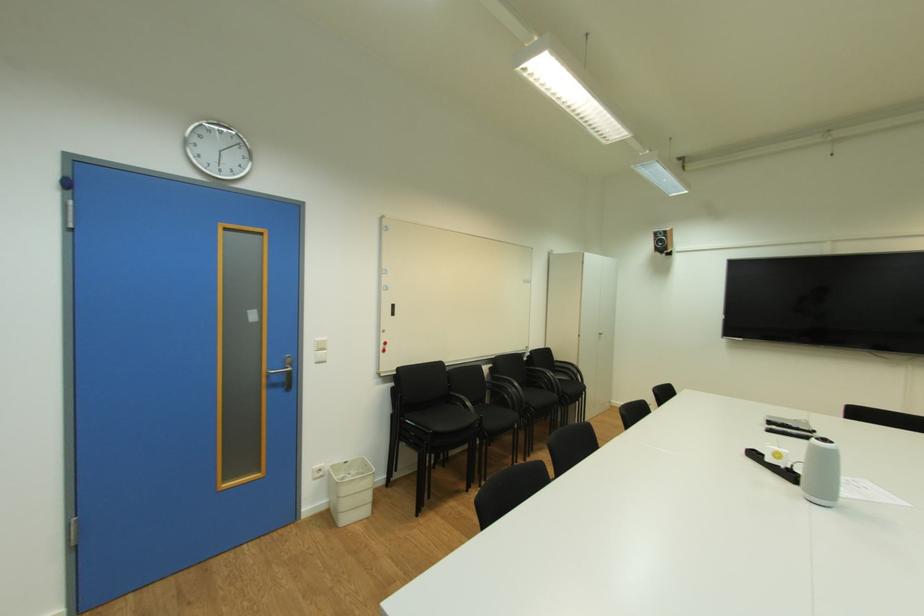
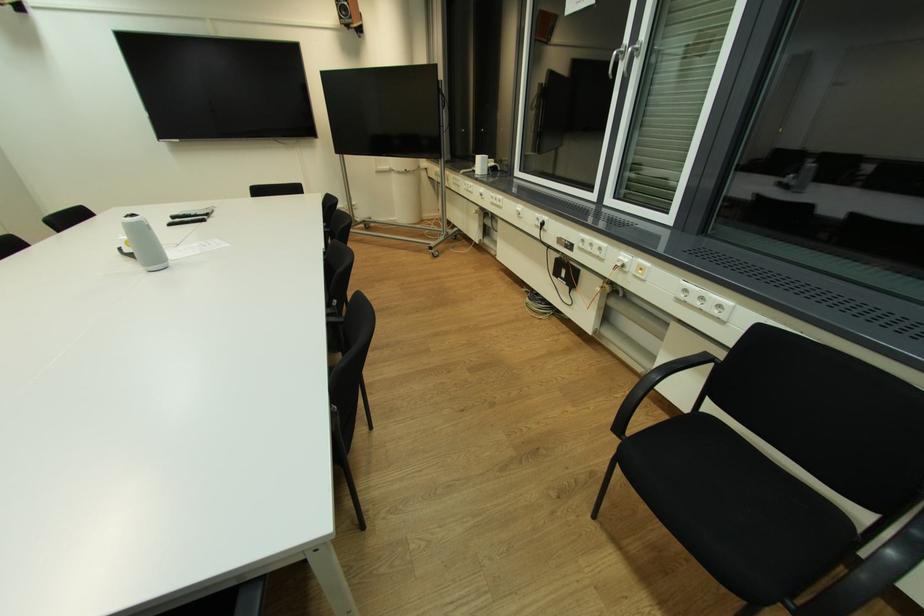
Where in the second image is the point corresponding to pixel 831 440 from the first image?

(137, 216)